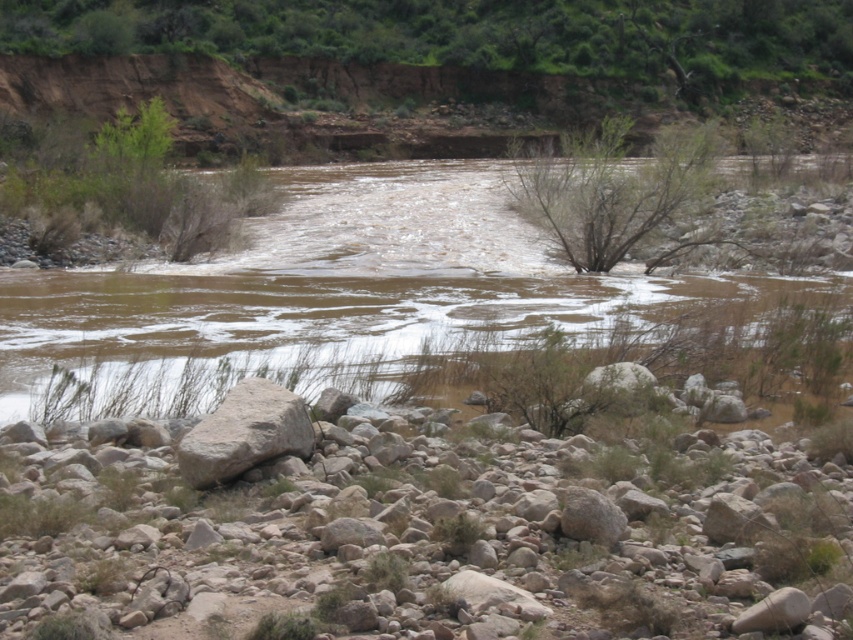
Question: Can you confirm if brown muddy stream at center is positioned above gray rough rock at lower left?

Choices:
 (A) no
 (B) yes

Answer: (B)

Question: Which object appears closest to the camera in this image?

Choices:
 (A) gray rough rock at lower left
 (B) brown muddy stream at center
 (C) gray rock at lower center

Answer: (A)

Question: Which object appears closest to the camera in this image?

Choices:
 (A) gray rough rock at lower left
 (B) gray rock at lower center

Answer: (A)

Question: Can you confirm if gray rock at lower center is bigger than gray rough rock at lower left?

Choices:
 (A) no
 (B) yes

Answer: (A)

Question: Can you confirm if gray rock at lower center is thinner than brown muddy stream at center?

Choices:
 (A) yes
 (B) no

Answer: (A)

Question: Among these objects, which one is nearest to the camera?

Choices:
 (A) brown muddy stream at center
 (B) gray rock at lower center

Answer: (B)